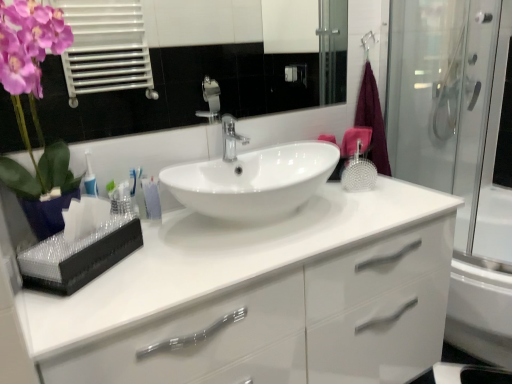
Identify the location of free space in front of white glossy sink at center. (204, 271).